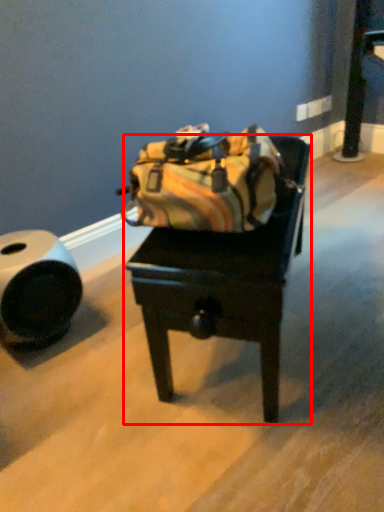
Question: Where is furniture (annotated by the red box) located in relation to tube in the image?

Choices:
 (A) left
 (B) right

Answer: (B)